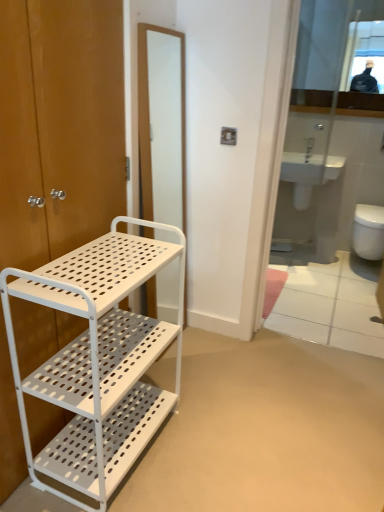
Question: From a real-world perspective, is white glossy toilet at right positioned above or below white matte screen door at center?

Choices:
 (A) above
 (B) below

Answer: (B)

Question: Relative to white matte screen door at center, is white glossy toilet at right in front or behind?

Choices:
 (A) behind
 (B) front

Answer: (A)

Question: Which object is positioned farthest from the matte wood door at left?

Choices:
 (A) glossy glass mirror at upper right, the first mirror when ordered from top to bottom
 (B) glossy glass mirror at upper right, acting as the second mirror starting from the top
 (C) white plastic bidet at center
 (D) white glossy toilet at right
 (E) white perforated metal shelf at left

Answer: (D)

Question: Considering the real-world distances, which object is farthest from the white perforated metal shelf at left?

Choices:
 (A) white glossy toilet at right
 (B) white matte screen door at center
 (C) white plastic bidet at center
 (D) glossy glass mirror at upper right, the second mirror from the bottom
 (E) white ceramic sink at center

Answer: (A)